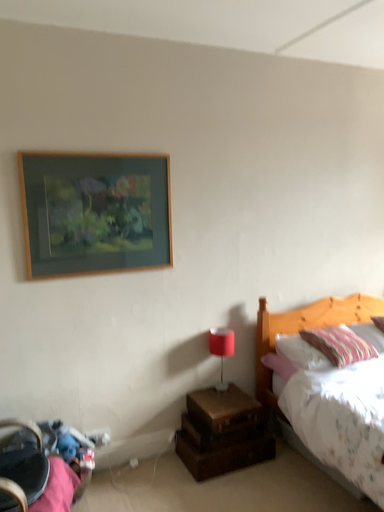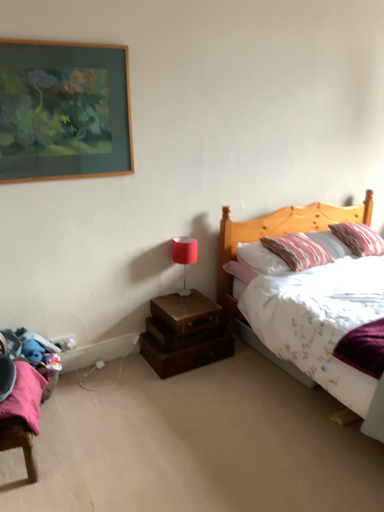
Question: How did the camera likely rotate when shooting the video?

Choices:
 (A) rotated downward
 (B) rotated upward

Answer: (A)